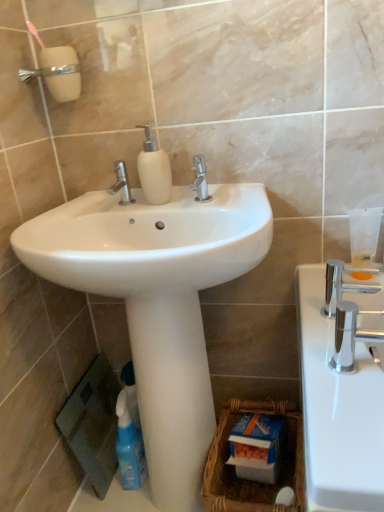
Find the location of a particular element. This screenshot has height=512, width=384. polished chrome faucet at center, which is the second tap in back-to-front order is located at coordinates (200, 179).

What is the approximate height of woven brown basket at lower center?

It is 8.79 inches.

Measure the distance between point [246,495] and camera.

1.15 meters.

Measure the distance between blue plastic spray bottle at lower left and camera.

The distance of blue plastic spray bottle at lower left from camera is 3.87 feet.

At what (x,y) coordinates should I click in order to perform the action: click on white glossy sink at center. Please return your answer as a coordinate pair (x, y). Looking at the image, I should click on (149, 241).

Describe the element at coordinates (343, 284) in the screenshot. The image size is (384, 512). I see `polished chrome faucet at right` at that location.

Locate an element on the screen. polished chrome faucet at right is located at coordinates (343, 284).

Find the location of a particular element. The width and height of the screenshot is (384, 512). polished chrome faucet at center, the 2th tap viewed from the left is located at coordinates (200, 179).

Can you confirm if polished chrome faucet at center, which is the second tap in back-to-front order, is shorter than blue plastic spray bottle at lower left?

Indeed, polished chrome faucet at center, which is the second tap in back-to-front order, has a lesser height compared to blue plastic spray bottle at lower left.

Visually, is polished chrome faucet at center, the 2th tap when ordered from front to back, positioned to the left or to the right of blue plastic spray bottle at lower left?

polished chrome faucet at center, the 2th tap when ordered from front to back, is positioned on blue plastic spray bottle at lower left's right side.

Is polished chrome faucet at center, which is counted as the first tap, starting from the top, oriented away from blue plastic spray bottle at lower left?

That's not correct — polished chrome faucet at center, which is counted as the first tap, starting from the top, is not looking away from blue plastic spray bottle at lower left.

Between polished chrome faucet at center, which is the second tap in back-to-front order, and blue plastic spray bottle at lower left, which one has smaller width?

Thinner between the two is polished chrome faucet at center, which is the second tap in back-to-front order.

Considering the sizes of objects blue plastic spray bottle at lower left and woven brown basket at lower center in the image provided, who is taller, blue plastic spray bottle at lower left or woven brown basket at lower center?

Standing taller between the two is blue plastic spray bottle at lower left.

From the image's perspective, which is above, blue plastic spray bottle at lower left or woven brown basket at lower center?

blue plastic spray bottle at lower left, from the image's perspective.

From a real-world perspective, is blue plastic spray bottle at lower left above or below woven brown basket at lower center?

blue plastic spray bottle at lower left is situated higher than woven brown basket at lower center in the real world.

Who is more distant, blue plastic spray bottle at lower left or woven brown basket at lower center?

Positioned behind is blue plastic spray bottle at lower left.

At what (x,y) coordinates should I click in order to perform the action: click on tap that appears below the polished chrome faucet at center, the 2th tap in the bottom-to-top sequence (from a real-world perspective). Please return your answer as a coordinate pair (x, y). The height and width of the screenshot is (512, 384). Looking at the image, I should click on (346, 317).

Consider the image. Which object is wider, polished chrome faucet at right, marked as the third tap in a left-to-right arrangement, or polished chrome faucet at center, the 2th tap in the bottom-to-top sequence?

polished chrome faucet at center, the 2th tap in the bottom-to-top sequence, is wider.

Are polished chrome faucet at right, which is counted as the third tap, starting from the back, and polished chrome faucet at center, which is counted as the 3th tap, starting from the front, beside each other?

There is a gap between polished chrome faucet at right, which is counted as the third tap, starting from the back, and polished chrome faucet at center, which is counted as the 3th tap, starting from the front.

From a real-world perspective, is polished chrome faucet at right, the 3th tap in the top-to-bottom sequence, above or below polished chrome faucet at center, which is the second tap in top-to-bottom order?

From a real-world perspective, polished chrome faucet at right, the 3th tap in the top-to-bottom sequence, is physically below polished chrome faucet at center, which is the second tap in top-to-bottom order.

Is white glossy sink at center positioned behind polished chrome faucet at center, the 2th tap positioned from the right?

No, the depth of white glossy sink at center is less than that of polished chrome faucet at center, the 2th tap positioned from the right.

From the image's perspective, is white glossy sink at center on top of polished chrome faucet at center, which is counted as the first tap, starting from the top?

No, from the image's perspective, white glossy sink at center is not on top of polished chrome faucet at center, which is counted as the first tap, starting from the top.

From the picture: From a real-world perspective, is white glossy sink at center over polished chrome faucet at center, the 2th tap viewed from the left?

No, from a real-world perspective, white glossy sink at center is not over polished chrome faucet at center, the 2th tap viewed from the left

Considering the sizes of white glossy sink at center and polished chrome faucet at center, which is counted as the first tap, starting from the top, in the image, is white glossy sink at center wider or thinner than polished chrome faucet at center, which is counted as the first tap, starting from the top,?

Considering their sizes, white glossy sink at center looks broader than polished chrome faucet at center, which is counted as the first tap, starting from the top.

Between white glossy sink at center and polished chrome faucet at center, the 2th tap in the bottom-to-top sequence, which one is positioned in front?

white glossy sink at center is more forward.

Could you measure the distance between white glossy sink at center and polished chrome faucet at center, arranged as the first tap when viewed from the left?

white glossy sink at center and polished chrome faucet at center, arranged as the first tap when viewed from the left, are 10.23 inches apart from each other.

Is point (189, 276) closer or farther from the camera than point (126, 185)?

Clearly, point (189, 276) is closer to the camera than point (126, 185).

From a real-world perspective, is white glossy sink at center under polished chrome faucet at right, marked as the third tap in a left-to-right arrangement?

No, from a real-world perspective, white glossy sink at center is not below polished chrome faucet at right, marked as the third tap in a left-to-right arrangement.

Can you confirm if white glossy sink at center is positioned to the right of polished chrome faucet at right, the 1th tap in the bottom-to-top sequence?

No.

Which point is more distant from viewer, (159, 249) or (353, 291)?

The point (159, 249) is farther.

Between woven brown basket at lower center and white glossy sink at center, which one is positioned in front?

white glossy sink at center is in front.

Considering the points (239, 407) and (188, 259), which point is in front, point (239, 407) or point (188, 259)?

The point (188, 259) is closer to the camera.

Find the location of a particular element. The width and height of the screenshot is (384, 512). cleaning product located below the polished chrome faucet at center, the 2th tap positioned from the right (from the image's perspective) is located at coordinates (129, 447).

Identify the location of basket beneath the blue plastic spray bottle at lower left (from a real-world perspective). Image resolution: width=384 pixels, height=512 pixels. (250, 480).

Considering their positions, is white matte soap dispenser at center positioned further to polished chrome faucet at center, arranged as the first tap when viewed from the left, than woven brown basket at lower center?

Among the two, woven brown basket at lower center is located further to polished chrome faucet at center, arranged as the first tap when viewed from the left.

Looking at the image, which one is located further to woven brown basket at lower center, polished chrome faucet at right or white glossy sink at center?

white glossy sink at center lies further to woven brown basket at lower center than the other object.

Based on the photo, looking at the image, which one is located closer to white glossy sink at center, polished chrome faucet at center, which is the second tap in top-to-bottom order, or blue plastic spray bottle at lower left?

Among the two, polished chrome faucet at center, which is the second tap in top-to-bottom order, is located nearer to white glossy sink at center.

When comparing their distances from polished chrome faucet at center, which is the second tap in top-to-bottom order, does white glossy pedestal at center or polished chrome faucet at right, which ranks as the 1th tap in right-to-left order, seem closer?

white glossy pedestal at center.

Looking at the image, which one is located further to polished chrome faucet at center, positioned as the third tap in bottom-to-top order, white glossy pedestal at center or polished chrome faucet at right, the first tap when ordered from front to back?

white glossy pedestal at center lies further to polished chrome faucet at center, positioned as the third tap in bottom-to-top order, than the other object.

Based on the photo, when comparing their distances from polished chrome faucet at center, which is counted as the 3th tap, starting from the front, does woven brown basket at lower center or polished chrome faucet at right seem further?

woven brown basket at lower center.

When comparing their distances from white glossy pedestal at center, does woven brown basket at lower center or polished chrome faucet at right, which is counted as the third tap, starting from the back, seem closer?

woven brown basket at lower center.

Looking at the image, which one is located closer to woven brown basket at lower center, polished chrome faucet at center, which is the second tap in top-to-bottom order, or white matte soap dispenser at center?

white matte soap dispenser at center lies closer to woven brown basket at lower center than the other object.

I want to click on cleaning product between polished chrome faucet at right and woven brown basket at lower center from top to bottom, so click(129, 447).

Identify the location of sink between polished chrome faucet at center, positioned as the third tap in bottom-to-top order, and blue plastic spray bottle at lower left from top to bottom. The width and height of the screenshot is (384, 512). (149, 241).

You are a GUI agent. You are given a task and a screenshot of the screen. Output one action in this format:
    pyautogui.click(x=<x>, y=<y>)
    Task: Click on the sink between polished chrome faucet at center, which is the 1th tap in back-to-front order, and polished chrome faucet at right, the 3th tap in the top-to-bottom sequence, from left to right
    
    Given the screenshot: What is the action you would take?
    pyautogui.click(x=149, y=241)

Identify the location of cleaning product that lies between polished chrome faucet at center, which is the 3th tap from right to left, and woven brown basket at lower center from top to bottom. This screenshot has width=384, height=512. (129, 447).